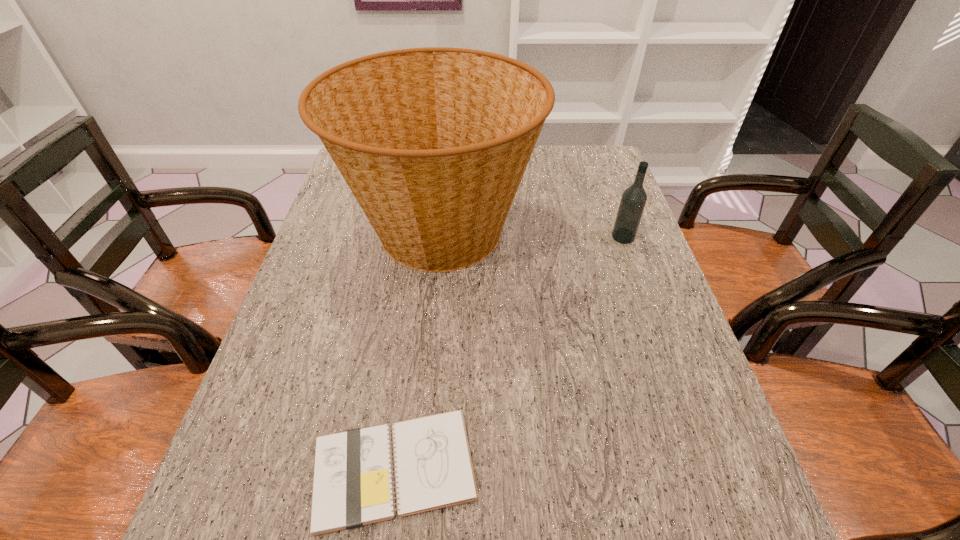
At what (x,y) coordinates should I click in order to perform the action: click on basket. Please return your answer as a coordinate pair (x, y). The width and height of the screenshot is (960, 540). Looking at the image, I should click on pos(433,142).

Where is `vodka`? Image resolution: width=960 pixels, height=540 pixels. vodka is located at coordinates (633, 200).

Identify the location of the second tallest object. (633, 200).

Image resolution: width=960 pixels, height=540 pixels. I want to click on the nearest object, so click(x=353, y=483).

This screenshot has height=540, width=960. Identify the location of the shortest object. (353, 483).

Locate an element on the screen. free point located on the right of the tallest object is located at coordinates [577, 230].

Where is `vacant point located on the back of the second shortest object`? This screenshot has width=960, height=540. vacant point located on the back of the second shortest object is located at coordinates (598, 166).

I want to click on free space located on the back of the notepad, so click(404, 389).

This screenshot has width=960, height=540. Identify the location of object positioned at the far edge. (433, 142).

This screenshot has width=960, height=540. Identify the location of object that is at the near edge. (353, 483).